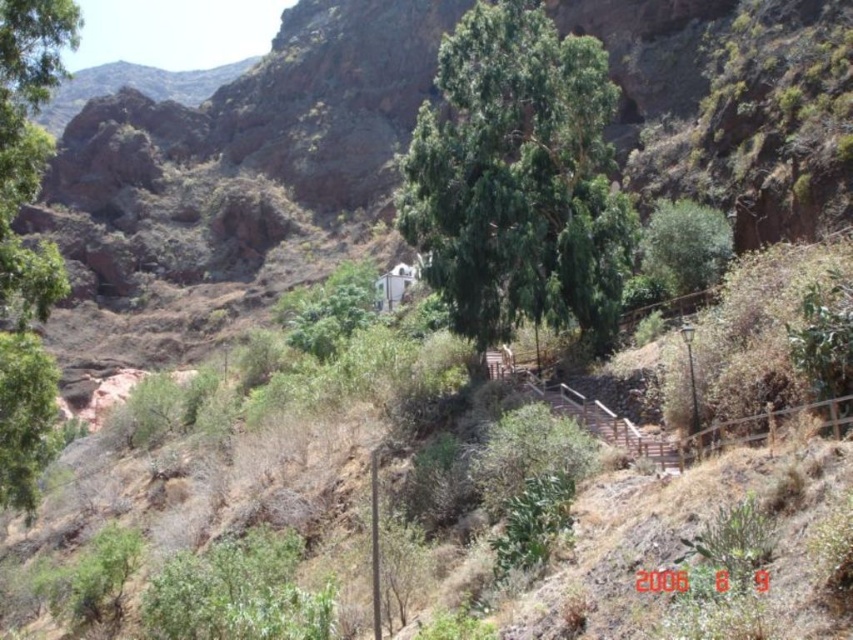
You are a hiker planning to take the wooden stairs up the hill. You notice two green leafy trees in the scene. Which tree, the green leafy tree at center or the green leafy tree at left, is narrower in width?

The green leafy tree at center is thinner than the green leafy tree at left, so the green leafy tree at center is narrower in width.